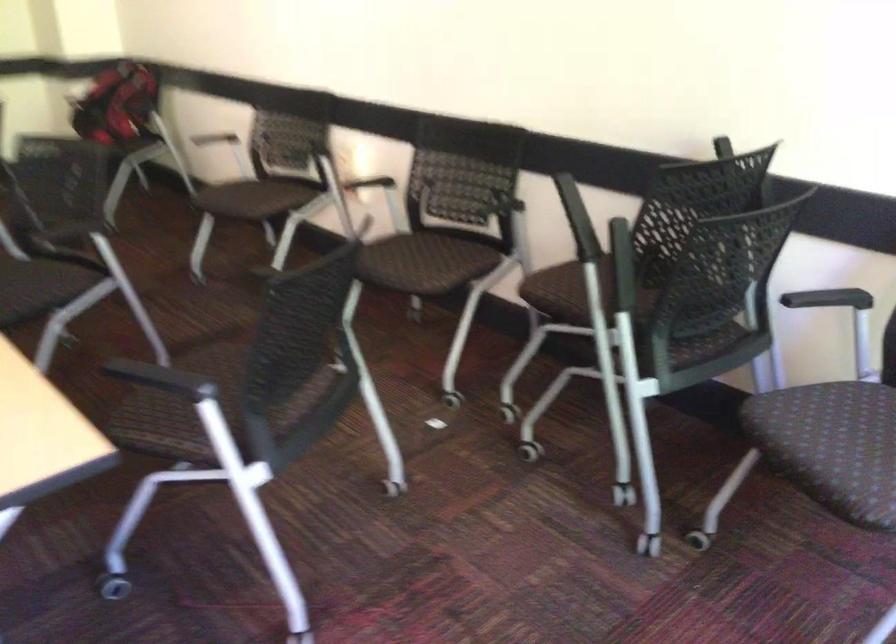
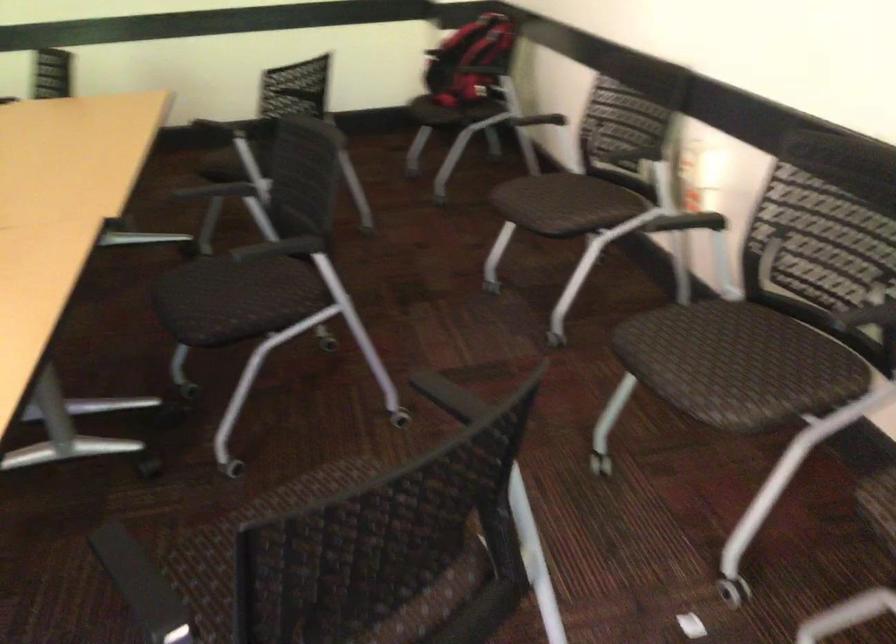
Question: The first image is from the beginning of the video and the second image is from the end. How did the camera likely rotate when shooting the video?

Choices:
 (A) Left
 (B) Right
 (C) Up
 (D) Down

Answer: (A)